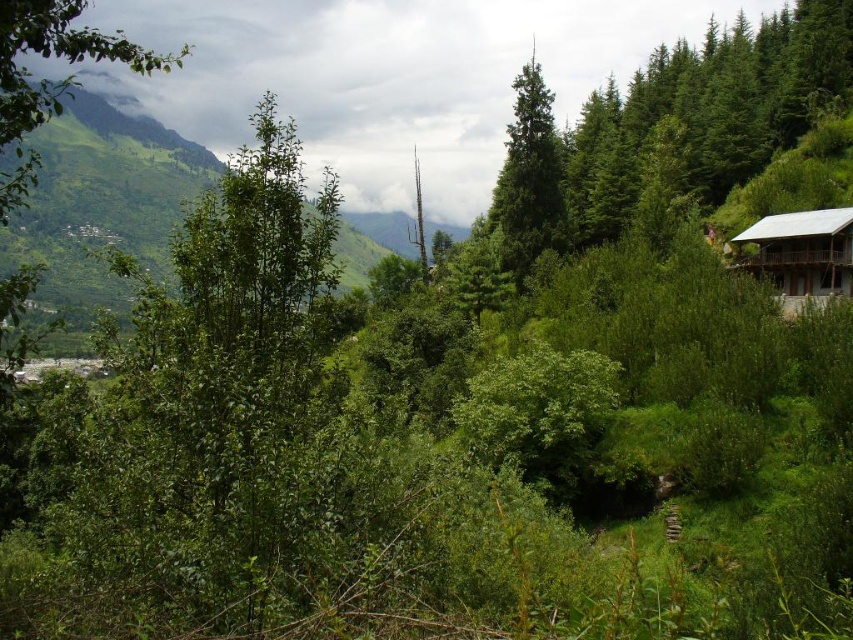
You are planning to build a new garden shed near the green matte tree at center and the white wooden cabin at right. Considering their sizes, which one would require more space vertically?

The green matte tree at center is much taller than the white wooden cabin at right, so it would require more vertical space.

You are a hiker standing at the origin point in the middle of the landscape. You want to reach the green matte tree at center. In which direction should you move to get there?

The green matte tree at center is located at coordinates point [529,179]. Since the origin is at the middle, moving towards the direction of the coordinates would require heading northeast.

From the picture: You are standing at the center of the landscape and want to locate the green matte tree at right. According to the coordinates provided, in which direction should you look to find it?

The green matte tree at right is located at coordinates point (677, 118). Since the x coordinate is 0.186, which is less than 0.5, it is positioned to the left side of the image. The y coordinate of 0.795 is closer to 1, indicating it is near the bottom of the image. Therefore, you should look to the lower left direction to find the green matte tree at right.